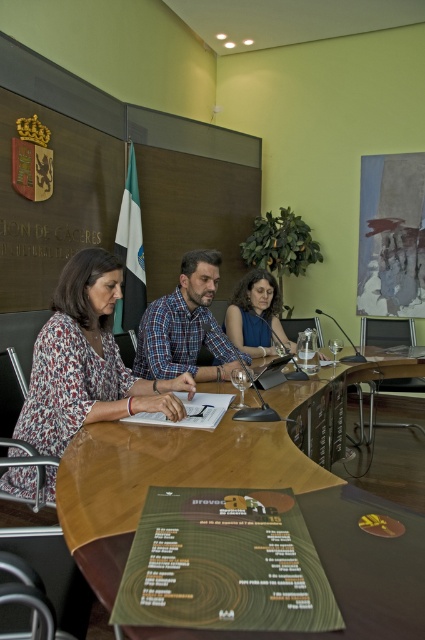
Does wooden table at center have a greater height compared to matte black hair at center?

No, wooden table at center is not taller than matte black hair at center.

Does point (333, 522) come behind point (258, 298)?

No, (333, 522) is in front of (258, 298).

This screenshot has height=640, width=425. Identify the location of wooden table at center. (238, 486).

Who is more distant from viewer, (13, 490) or (235, 294)?

Positioned behind is point (235, 294).

Who is more forward, (x=82, y=384) or (x=268, y=317)?

Point (x=82, y=384)

The image size is (425, 640). What are the coordinates of `floral fabric blouse at left` in the screenshot? It's located at (87, 362).

Can you confirm if blue plaid shirt at center is positioned below matte black hair at center?

Incorrect, blue plaid shirt at center is not positioned below matte black hair at center.

Which is more to the left, blue plaid shirt at center or matte black hair at center?

Positioned to the left is blue plaid shirt at center.

Between point (181, 260) and point (249, 288), which one is positioned in front?

Point (181, 260)

Identify the location of blue plaid shirt at center. This screenshot has width=425, height=640. (184, 326).